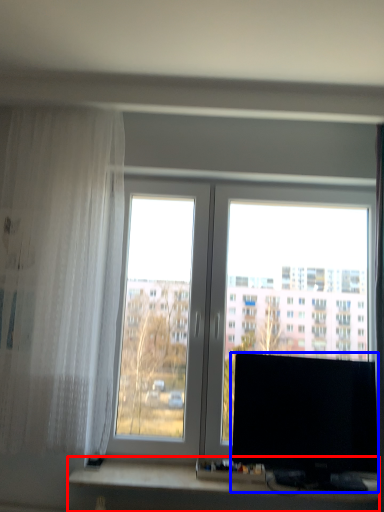
Question: Among these objects, which one is farthest to the camera, computer desk (highlighted by a red box) or computer monitor (highlighted by a blue box)?

Choices:
 (A) computer desk
 (B) computer monitor

Answer: (A)